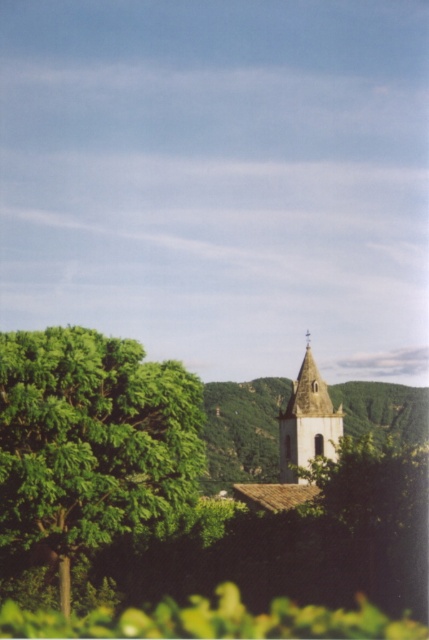
You are standing in the rural landscape and want to take a photo of the white stone tower at center and the light brown stone church at center. Which one will appear closer to the bottom of your camera viewfinder?

The white stone tower at center is located below the light brown stone church at center, so it will appear closer to the bottom of the camera viewfinder.

You are standing in a rural area and see the green leafy tree at left and the light brown stone church at center. Which object is closer to you?

The green leafy tree at left is closer to you because it is in front of the light brown stone church at center.

You are standing in the rural landscape and want to take a photo of the light brown stone church at center without the green leafy tree at left blocking the view. Which direction should you move to ensure the tree is no longer in front of the church?

Move to the right side so that the green leafy tree at left is no longer blocking the light brown stone church at center, as the tree is positioned to the left of the church.